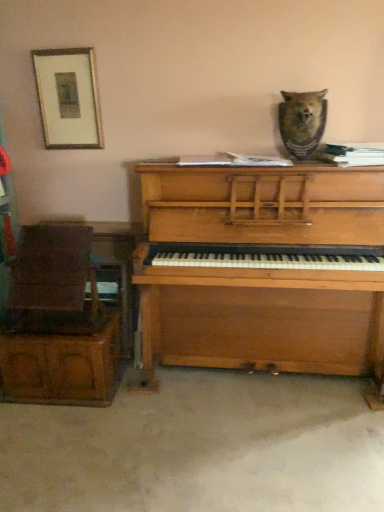
This screenshot has height=512, width=384. What are the coordinates of `vacant space in brown fur bear at upper center (from a real-world perspective)` in the screenshot? It's located at (296, 161).